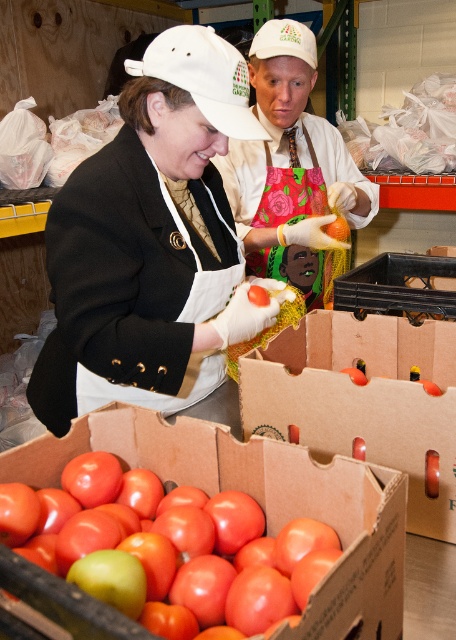
Is shiny red tomato at lower left smaller than matte white cap at upper center?

Indeed, shiny red tomato at lower left has a smaller size compared to matte white cap at upper center.

Where is `shiny red tomato at lower left`? The height and width of the screenshot is (640, 456). shiny red tomato at lower left is located at coordinates (170, 545).

Which is behind, point (109, 483) or point (346, 211)?

The point (346, 211) is behind.

In order to click on shiny red tomato at lower left in this screenshot , I will do `click(170, 545)`.

Can you confirm if white matte apron at center is wider than cardboard box at lower center?

Indeed, white matte apron at center has a greater width compared to cardboard box at lower center.

Is white matte apron at center behind cardboard box at lower center?

That is True.

The height and width of the screenshot is (640, 456). Describe the element at coordinates (150, 243) in the screenshot. I see `white matte apron at center` at that location.

Where is `white matte apron at center`? Image resolution: width=456 pixels, height=640 pixels. white matte apron at center is located at coordinates (150, 243).

Between cardboard box at lower center and matte white cap at upper center, which one appears on the right side from the viewer's perspective?

Positioned to the right is cardboard box at lower center.

This screenshot has height=640, width=456. Identify the location of cardboard box at lower center. point(363,401).

In order to click on cardboard box at lower center in this screenshot , I will do `click(363, 401)`.